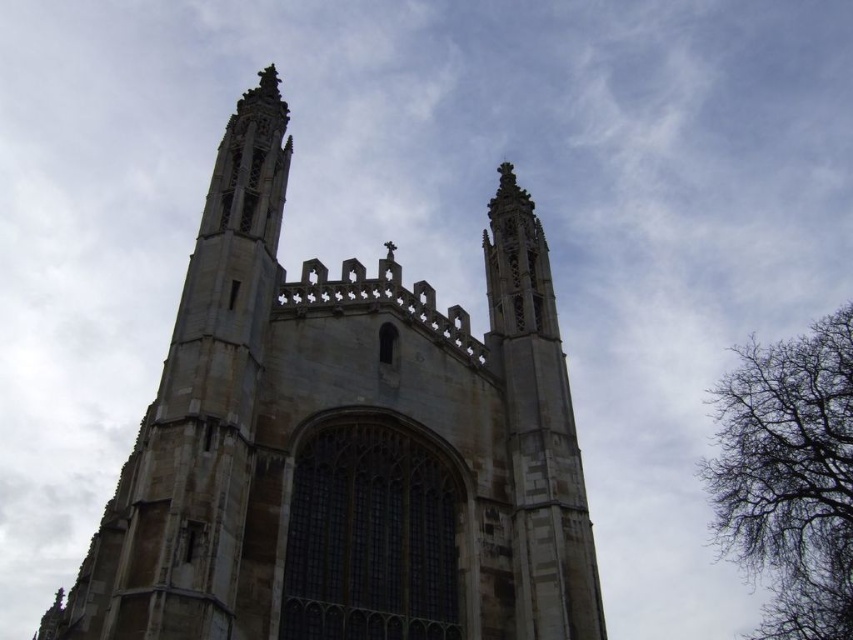
Who is more distant from viewer, (515, 253) or (757, 372)?

The point (757, 372) is behind.

Measure the distance between stone church at center and camera.

stone church at center and camera are 37.75 meters apart.

Identify the location of stone church at center. (344, 444).